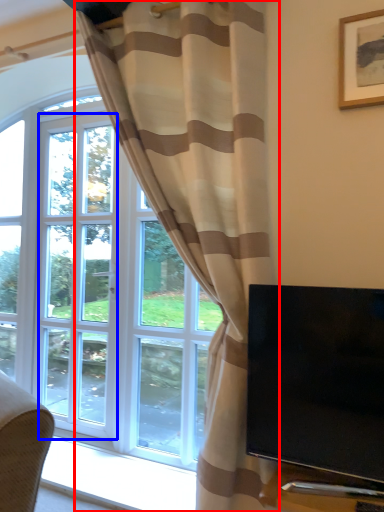
Question: Which object is closer to the camera taking this photo, curtain (highlighted by a red box) or screen door (highlighted by a blue box)?

Choices:
 (A) curtain
 (B) screen door

Answer: (A)